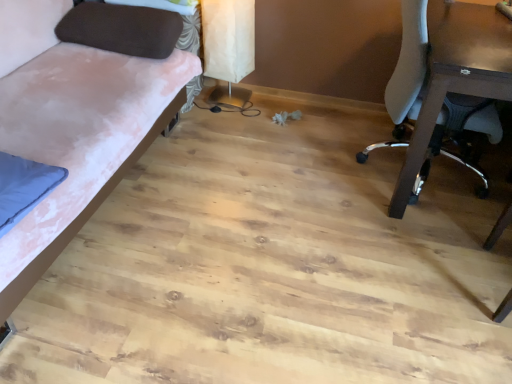
This screenshot has width=512, height=384. Find the location of `vacant space that is in between white paper lampshade at upper center and white mesh chair at right`. vacant space that is in between white paper lampshade at upper center and white mesh chair at right is located at coordinates (301, 133).